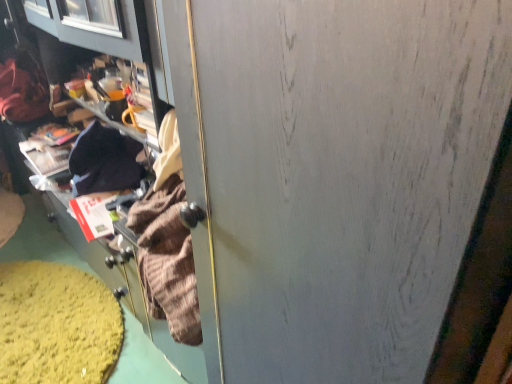
Where is `free location above cardboard box at lower left (from a real-world perspective)`? The image size is (512, 384). free location above cardboard box at lower left (from a real-world perspective) is located at coordinates (57, 318).